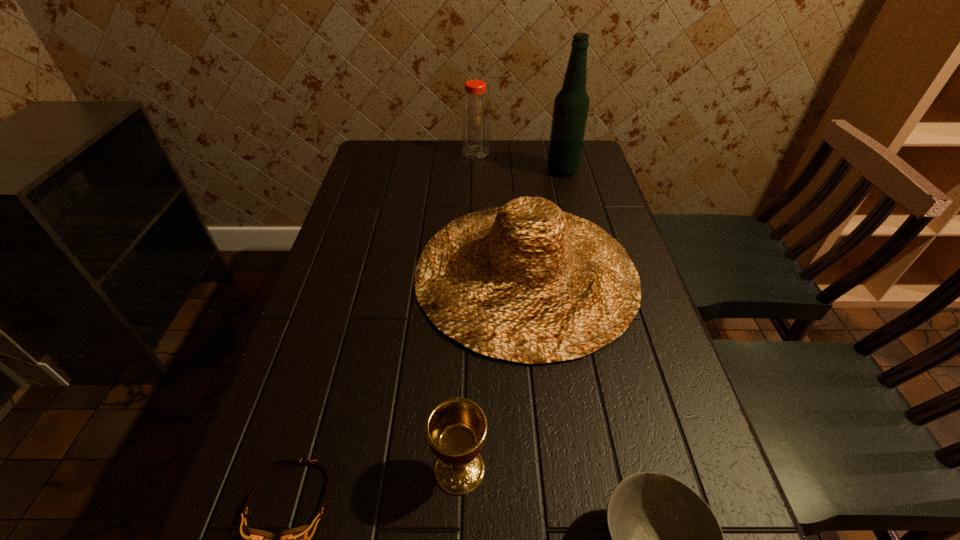
At what (x,y) coordinates should I click in order to perform the action: click on free space between the farthest object and the fifth nearest object. Please return your answer as a coordinate pair (x, y). The width and height of the screenshot is (960, 540). Looking at the image, I should click on (519, 161).

Locate an element on the screen. object that is the second closest one to the fifth shortest object is located at coordinates point(527,282).

Image resolution: width=960 pixels, height=540 pixels. I want to click on object that is the fifth closest to the tallest object, so click(x=295, y=539).